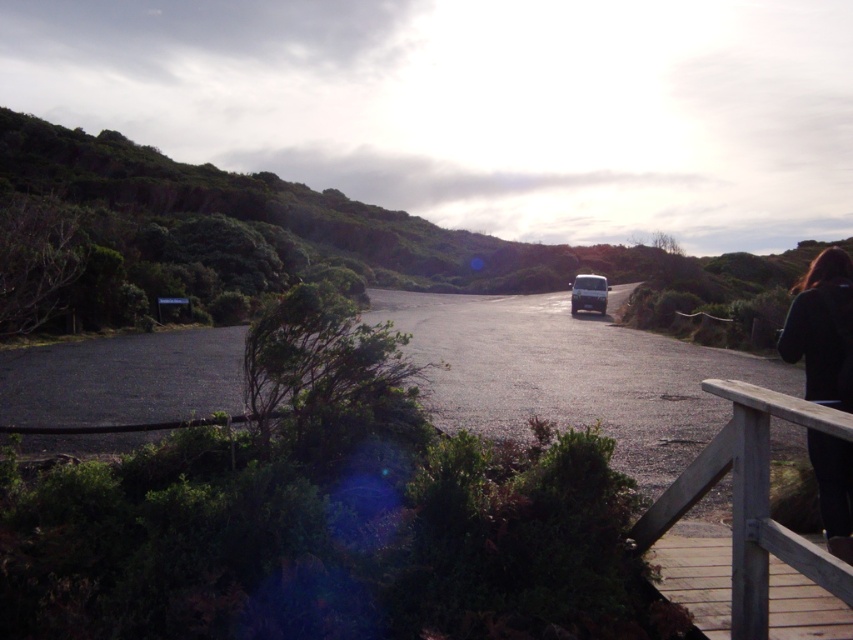
You are standing at the starting point of the road in the scenic outdoor setting. There is a wooden object marked at point (751, 500). Can you tell me the direction of the wooden object relative to your position?

The wooden object marked at point (751, 500) is located to the right side of your position.